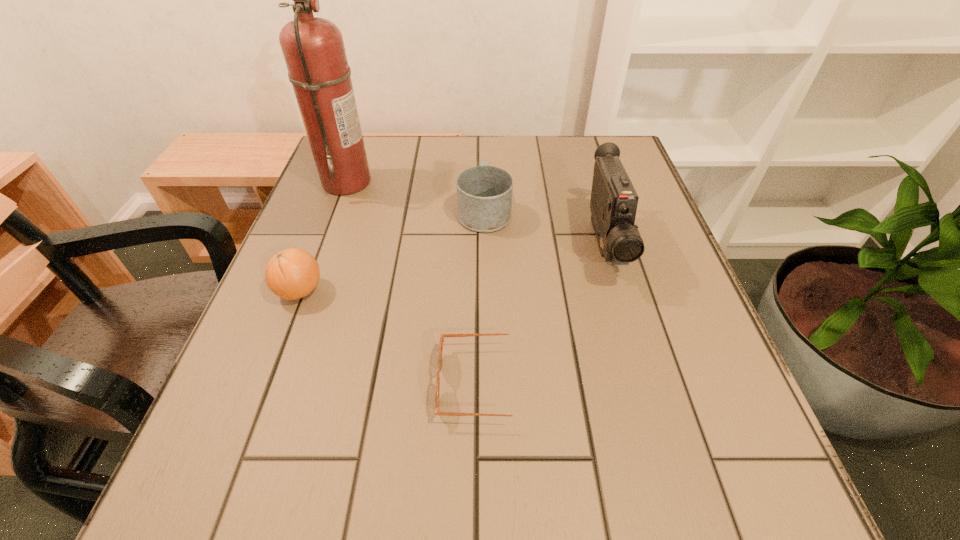
At what (x,y) coordinates should I click in order to perform the action: click on free location located 0.230m on the side of the mug with the handle. Please return your answer as a coordinate pair (x, y). Image resolution: width=960 pixels, height=540 pixels. Looking at the image, I should click on (484, 144).

Find the location of a particular element. free spot located on the side of the mug with the handle is located at coordinates (484, 137).

This screenshot has width=960, height=540. In order to click on free space located on the right of the orange in this screenshot , I will do `click(365, 291)`.

The height and width of the screenshot is (540, 960). I want to click on free point located on the front-facing side of the nearest object, so click(385, 383).

In order to click on vacant space located on the front-facing side of the nearest object in this screenshot , I will do `click(391, 383)`.

At what (x,y) coordinates should I click in order to perform the action: click on free location located on the front-facing side of the nearest object. Please return your answer as a coordinate pair (x, y). This screenshot has height=540, width=960. Looking at the image, I should click on (348, 383).

Image resolution: width=960 pixels, height=540 pixels. What are the coordinates of `object situated at the far edge` in the screenshot? It's located at (313, 48).

In order to click on fire extinguisher that is at the left edge in this screenshot , I will do `click(313, 48)`.

In order to click on orange located at the left edge in this screenshot , I will do `click(293, 273)`.

The height and width of the screenshot is (540, 960). What are the coordinates of `object that is at the right edge` in the screenshot? It's located at (613, 205).